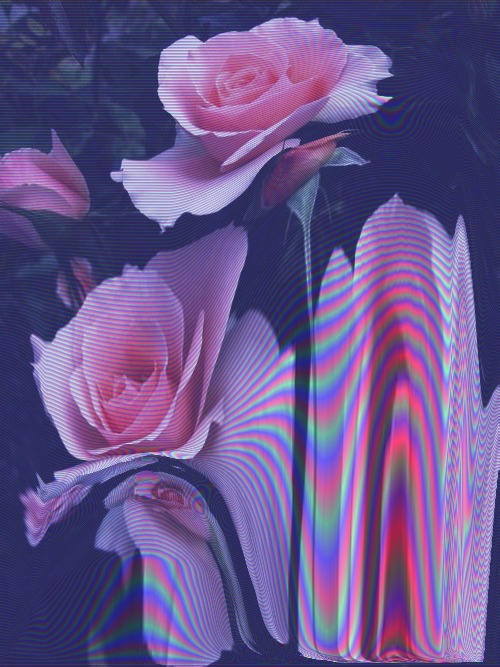
In order to click on picture in this screenshot , I will do `click(174, 513)`.